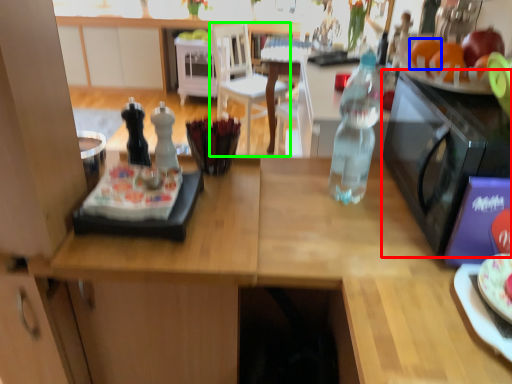
Question: Considering the real-world distances, which object is closest to microwave oven (highlighted by a red box)? orange (highlighted by a blue box) or chair (highlighted by a green box).

Choices:
 (A) orange
 (B) chair

Answer: (A)